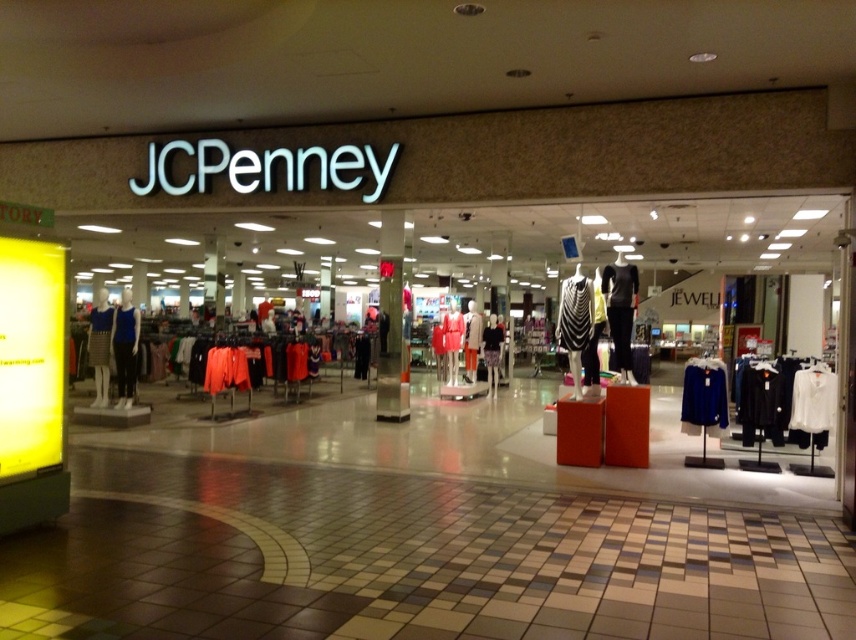
Can you confirm if blue fabric coat at center is positioned to the right of matte blue dress at left?

Indeed, blue fabric coat at center is positioned on the right side of matte blue dress at left.

Between blue fabric coat at center and matte blue dress at left, which one is positioned higher?

Positioned higher is matte blue dress at left.

Where is `blue fabric coat at center`? blue fabric coat at center is located at coordinates (703, 397).

Identify the location of blue fabric coat at center. (703, 397).

Is black matte dress at center smaller than matte black dress at center?

Actually, black matte dress at center might be larger than matte black dress at center.

Does black matte dress at center have a greater height compared to matte black dress at center?

No, black matte dress at center is not taller than matte black dress at center.

Does point (605, 280) lie behind point (465, 371)?

That is False.

Find the location of a particular element. black matte dress at center is located at coordinates (620, 308).

Is black matte dress at center below striped fabric dress at center?

Incorrect, black matte dress at center is not positioned below striped fabric dress at center.

Between point (620, 337) and point (495, 337), which one is positioned in front?

Point (620, 337)

The height and width of the screenshot is (640, 856). Describe the element at coordinates (620, 308) in the screenshot. I see `black matte dress at center` at that location.

Identify the location of black matte dress at center. Image resolution: width=856 pixels, height=640 pixels. (620, 308).